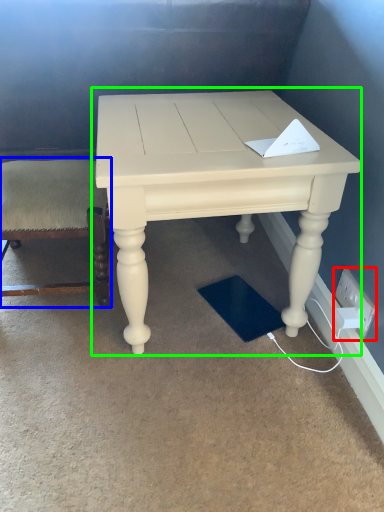
Question: Considering the real-world distances, which object is farthest from electric outlet (highlighted by a red box)? chair (highlighted by a blue box) or table (highlighted by a green box)?

Choices:
 (A) chair
 (B) table

Answer: (A)